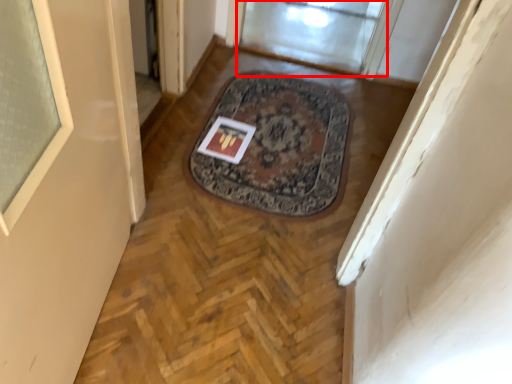
Question: In this image, where is window screen (annotated by the red box) located relative to postcard?

Choices:
 (A) left
 (B) right

Answer: (B)